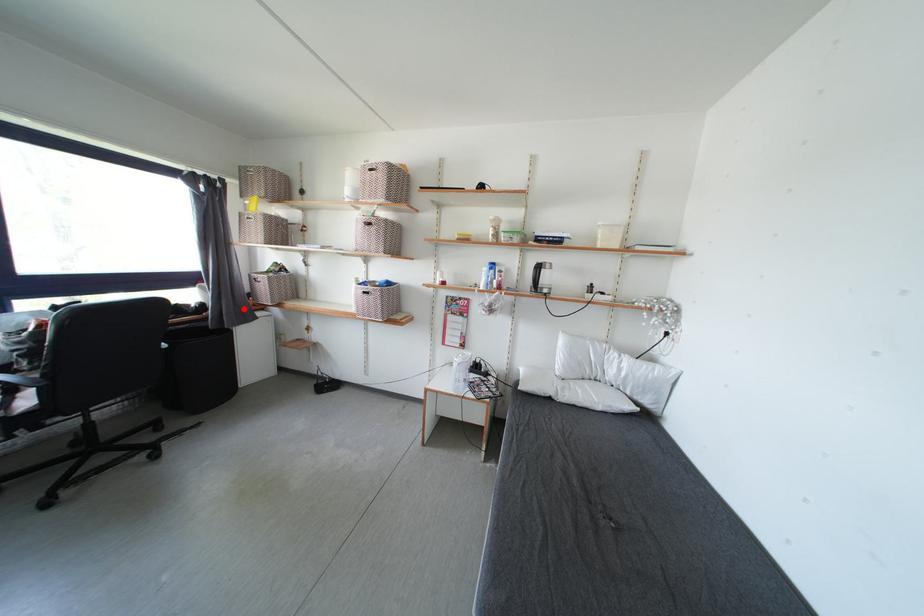
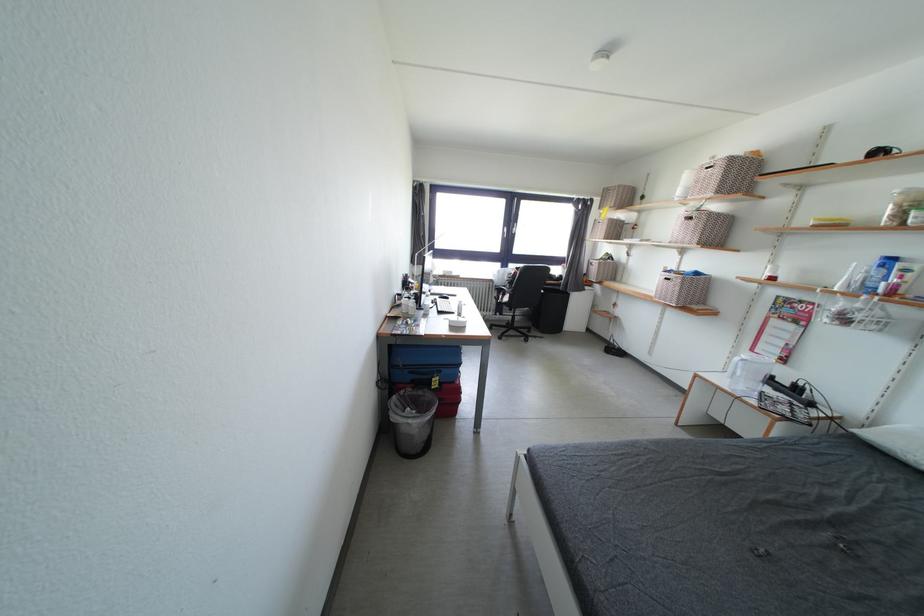
The point at the highlighted location is marked in the first image. Where is the corresponding point in the second image?

(584, 284)